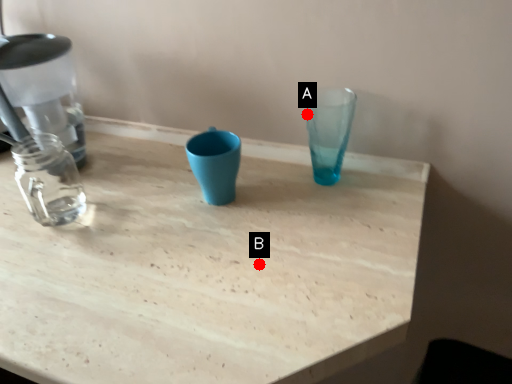
Question: Two points are circled on the image, labeled by A and B beside each circle. Which point is closer to the camera taking this photo?

Choices:
 (A) A is closer
 (B) B is closer

Answer: (B)